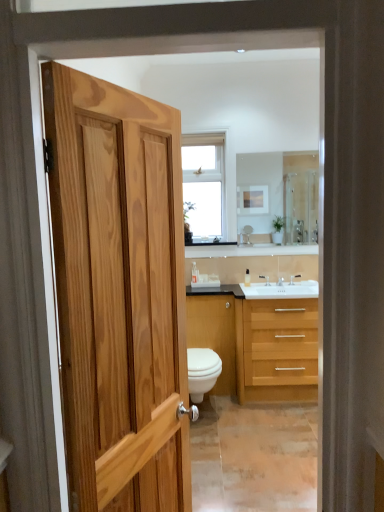
Find the location of a particular element. free spot above white glossy toilet at center (from a real-world perspective) is located at coordinates (197, 354).